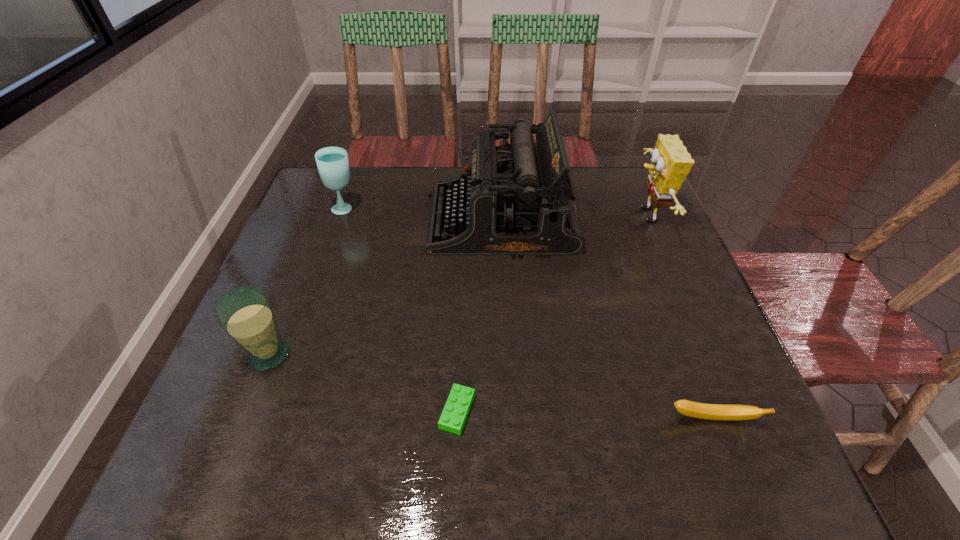
At what (x,y) coordinates should I click in order to perform the action: click on banana at the right edge. Please return your answer as a coordinate pair (x, y). This screenshot has height=540, width=960. Looking at the image, I should click on (692, 409).

You are a GUI agent. You are given a task and a screenshot of the screen. Output one action in this format:
    pyautogui.click(x=<x>, y=<y>)
    Task: Click on the object that is positioned at the far left corner
    The width and height of the screenshot is (960, 540).
    Given the screenshot: What is the action you would take?
    pyautogui.click(x=332, y=162)

This screenshot has width=960, height=540. I want to click on object that is at the far right corner, so click(670, 163).

This screenshot has height=540, width=960. Find the location of `vacant space at the far edge`. vacant space at the far edge is located at coordinates (370, 189).

The width and height of the screenshot is (960, 540). In the image, there is a desktop. Identify the location of vacant space at the left edge. (240, 361).

This screenshot has width=960, height=540. I want to click on vacant space at the right edge of the desktop, so click(x=732, y=399).

This screenshot has width=960, height=540. In order to click on vacant space at the near left corner of the desktop in this screenshot , I will do `click(277, 435)`.

Locate an element on the screen. free space at the far right corner of the desktop is located at coordinates (618, 168).

This screenshot has width=960, height=540. Identify the location of vacant area at the near right corner. (716, 442).

You are a GUI agent. You are given a task and a screenshot of the screen. Output one action in this format:
    pyautogui.click(x=<x>, y=<y>)
    Task: Click on the empty space between the fourth farthest object and the sponge
    This screenshot has height=540, width=960.
    Given the screenshot: What is the action you would take?
    pyautogui.click(x=457, y=285)